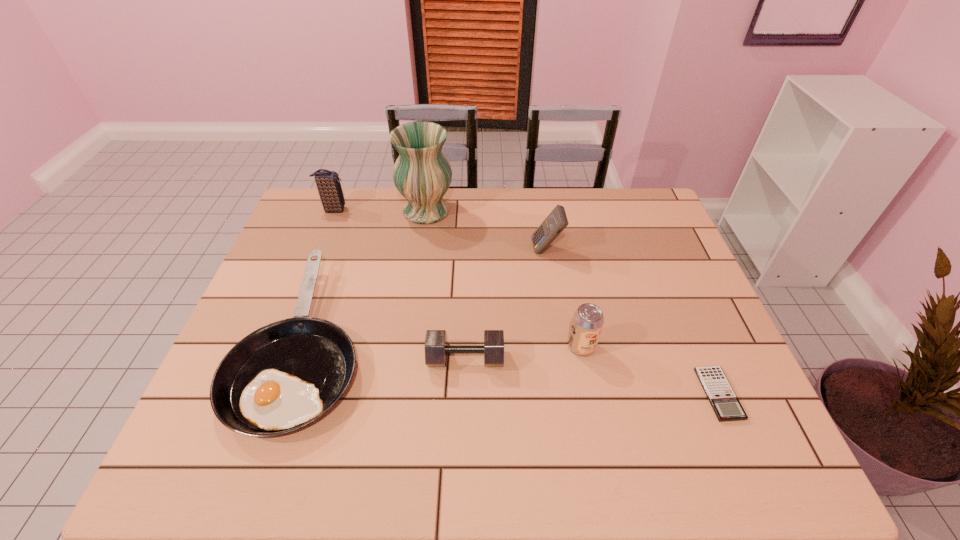
Find the location of a particular element. free space at the near left corner is located at coordinates (205, 448).

Find the location of a particular element. blank region between the clutch bag and the left calculator is located at coordinates (x=441, y=230).

Locate an element on the screen. The width and height of the screenshot is (960, 540). free point between the right calculator and the fourth shortest object is located at coordinates (650, 370).

Image resolution: width=960 pixels, height=540 pixels. I want to click on unoccupied area between the vase and the clutch bag, so tap(380, 210).

The image size is (960, 540). I want to click on vacant space in between the shorter calculator and the second shortest object, so click(512, 368).

What are the coordinates of `free spot between the third farthest object and the fourth shortest object` in the screenshot? It's located at (564, 298).

This screenshot has height=540, width=960. Identify the location of free space between the beer can and the third shortest object. (523, 353).

This screenshot has width=960, height=540. What are the coordinates of `free spot between the vase and the sixth tallest object` in the screenshot? It's located at (366, 276).

This screenshot has width=960, height=540. I want to click on free space between the taller calculator and the shorter calculator, so click(x=633, y=322).

The width and height of the screenshot is (960, 540). Find the location of `vacant point located between the taller calculator and the fourth shortest object`. vacant point located between the taller calculator and the fourth shortest object is located at coordinates (564, 298).